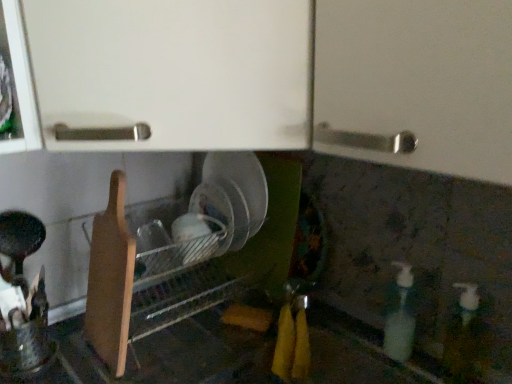
Question: Does white glossy bottle at lower right, the first bottle positioned from the right, have a greater height compared to wooden cutting board at lower left?

Choices:
 (A) no
 (B) yes

Answer: (A)

Question: Considering the relative sizes of white glossy bottle at lower right, the first bottle positioned from the right, and wooden cutting board at lower left in the image provided, is white glossy bottle at lower right, the first bottle positioned from the right, wider than wooden cutting board at lower left?

Choices:
 (A) no
 (B) yes

Answer: (A)

Question: Is white glossy bottle at lower right, the first bottle positioned from the right, bigger than wooden cutting board at lower left?

Choices:
 (A) yes
 (B) no

Answer: (B)

Question: Is white glossy bottle at lower right, which is the second bottle from left to right, further to the viewer compared to wooden cutting board at lower left?

Choices:
 (A) no
 (B) yes

Answer: (A)

Question: Could you tell me if white glossy bottle at lower right, the first bottle positioned from the right, is turned towards wooden cutting board at lower left?

Choices:
 (A) no
 (B) yes

Answer: (A)

Question: Does point click(387, 329) appear closer or farther from the camera than point click(271, 223)?

Choices:
 (A) closer
 (B) farther

Answer: (A)

Question: Is translucent plastic soap dispenser at lower right, which is the first bottle from left to right, situated inside wooden cutting board at lower left or outside?

Choices:
 (A) outside
 (B) inside

Answer: (A)

Question: In terms of height, does translucent plastic soap dispenser at lower right, which is the first bottle from left to right, look taller or shorter compared to wooden cutting board at lower left?

Choices:
 (A) tall
 (B) short

Answer: (B)

Question: Looking at the image, does translucent plastic soap dispenser at lower right, which is the first bottle from left to right, seem bigger or smaller compared to wooden cutting board at lower left?

Choices:
 (A) small
 (B) big

Answer: (A)

Question: Based on their sizes in the image, would you say translucent plastic soap dispenser at lower right, the 2th bottle when ordered from right to left, is bigger or smaller than white glossy bottle at lower right, the first bottle positioned from the right?

Choices:
 (A) small
 (B) big

Answer: (A)

Question: From a real-world perspective, relative to white glossy bottle at lower right, which is the second bottle from left to right, is translucent plastic soap dispenser at lower right, which is the first bottle from left to right, vertically above or below?

Choices:
 (A) below
 (B) above

Answer: (A)

Question: From the image's perspective, is translucent plastic soap dispenser at lower right, which is the first bottle from left to right, located above or below white glossy bottle at lower right, which is the second bottle from left to right?

Choices:
 (A) below
 (B) above

Answer: (B)

Question: Is point (396, 289) positioned closer to the camera than point (482, 337)?

Choices:
 (A) closer
 (B) farther

Answer: (B)

Question: Is white glossy bottle at lower right, the first bottle positioned from the right, wider or thinner than translucent plastic soap dispenser at lower right, which is the first bottle from left to right?

Choices:
 (A) thin
 (B) wide

Answer: (B)

Question: From a real-world perspective, is white glossy bottle at lower right, the first bottle positioned from the right, physically located above or below translucent plastic soap dispenser at lower right, the 2th bottle when ordered from right to left?

Choices:
 (A) above
 (B) below

Answer: (A)